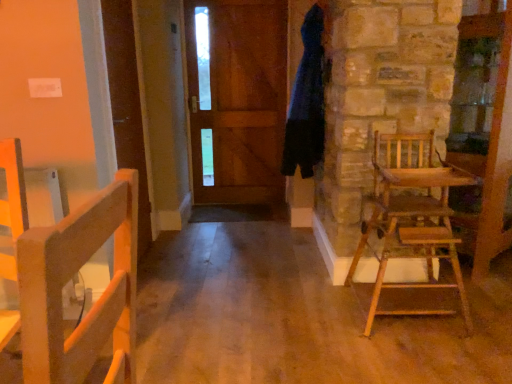
Locate an element on the screen. free spot to the right of wooden high chair at right is located at coordinates (486, 302).